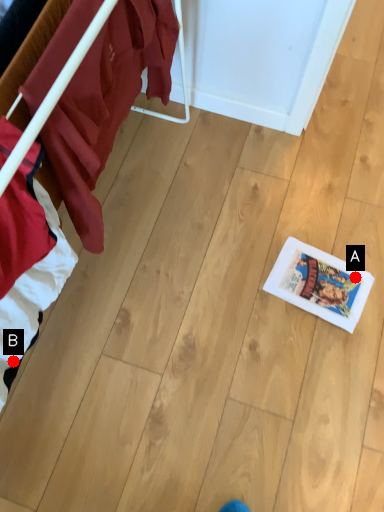
Question: Two points are circled on the image, labeled by A and B beside each circle. Which of the following is the farthest from the observer?

Choices:
 (A) A is further
 (B) B is further

Answer: (A)